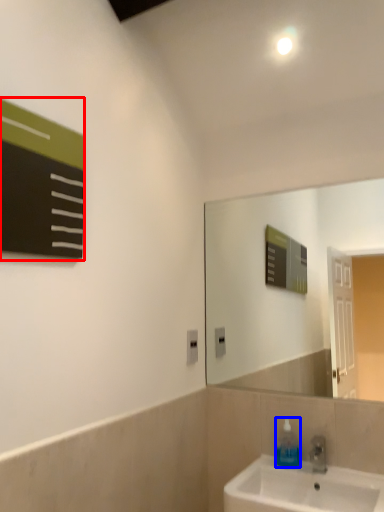
Question: Which object is closer to the camera taking this photo, bulletin board (highlighted by a red box) or soap dispenser (highlighted by a blue box)?

Choices:
 (A) bulletin board
 (B) soap dispenser

Answer: (A)